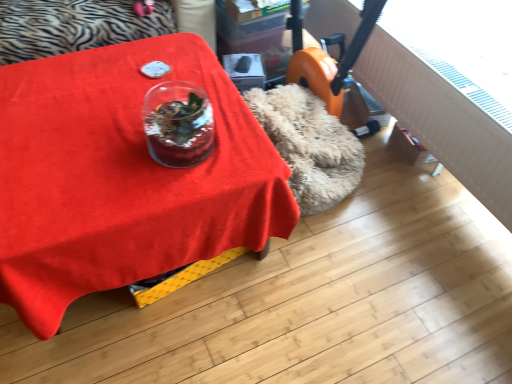
You are a GUI agent. You are given a task and a screenshot of the screen. Output one action in this format:
    pyautogui.click(x=<x>, y=<y>)
    Task: Click on the vacant space to the left of transparent glass vase at center
    This screenshot has height=384, width=512.
    Given the screenshot: What is the action you would take?
    pyautogui.click(x=115, y=142)